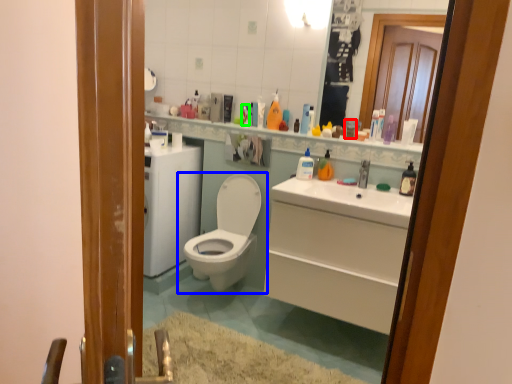
Question: Which object is positioned closest to toiletry (highlighted by a red box)? Select from toilet (highlighted by a blue box) and toiletry (highlighted by a green box).

Choices:
 (A) toilet
 (B) toiletry

Answer: (B)